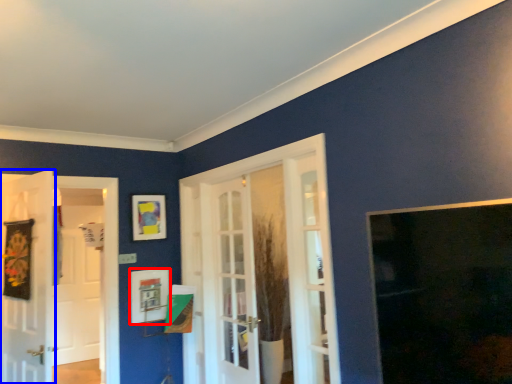
Question: Which point is further to the camera, picture frame (highlighted by a red box) or door (highlighted by a blue box)?

Choices:
 (A) picture frame
 (B) door

Answer: (A)